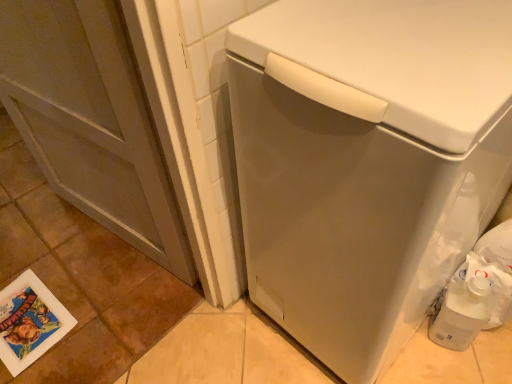
Question: Can you confirm if printed paper postcard at lower left is positioned to the right of white matte washing machine at center?

Choices:
 (A) yes
 (B) no

Answer: (B)

Question: Does printed paper postcard at lower left have a greater height compared to white matte washing machine at center?

Choices:
 (A) yes
 (B) no

Answer: (B)

Question: Is printed paper postcard at lower left thinner than white matte washing machine at center?

Choices:
 (A) yes
 (B) no

Answer: (A)

Question: Does printed paper postcard at lower left turn towards white matte washing machine at center?

Choices:
 (A) yes
 (B) no

Answer: (B)

Question: From a real-world perspective, is printed paper postcard at lower left located higher than white matte washing machine at center?

Choices:
 (A) yes
 (B) no

Answer: (B)

Question: From the image's perspective, is white plastic jug at lower right above or below printed paper postcard at lower left?

Choices:
 (A) above
 (B) below

Answer: (A)

Question: From a real-world perspective, relative to printed paper postcard at lower left, is white plastic jug at lower right vertically above or below?

Choices:
 (A) below
 (B) above

Answer: (B)

Question: Is point (442, 307) positioned closer to the camera than point (41, 339)?

Choices:
 (A) closer
 (B) farther

Answer: (A)

Question: Visually, is white plastic jug at lower right positioned to the left or to the right of printed paper postcard at lower left?

Choices:
 (A) right
 (B) left

Answer: (A)

Question: Is matte gray screen door at left inside the boundaries of white matte washing machine at center, or outside?

Choices:
 (A) outside
 (B) inside

Answer: (A)

Question: From a real-world perspective, is matte gray screen door at left physically located above or below white matte washing machine at center?

Choices:
 (A) above
 (B) below

Answer: (B)

Question: From the image's perspective, is matte gray screen door at left positioned above or below white matte washing machine at center?

Choices:
 (A) above
 (B) below

Answer: (A)

Question: Considering the positions of matte gray screen door at left and white matte washing machine at center in the image, is matte gray screen door at left wider or thinner than white matte washing machine at center?

Choices:
 (A) wide
 (B) thin

Answer: (B)

Question: From the image's perspective, relative to printed paper postcard at lower left, is matte gray screen door at left above or below?

Choices:
 (A) below
 (B) above

Answer: (B)

Question: Is matte gray screen door at left wider or thinner than printed paper postcard at lower left?

Choices:
 (A) wide
 (B) thin

Answer: (B)